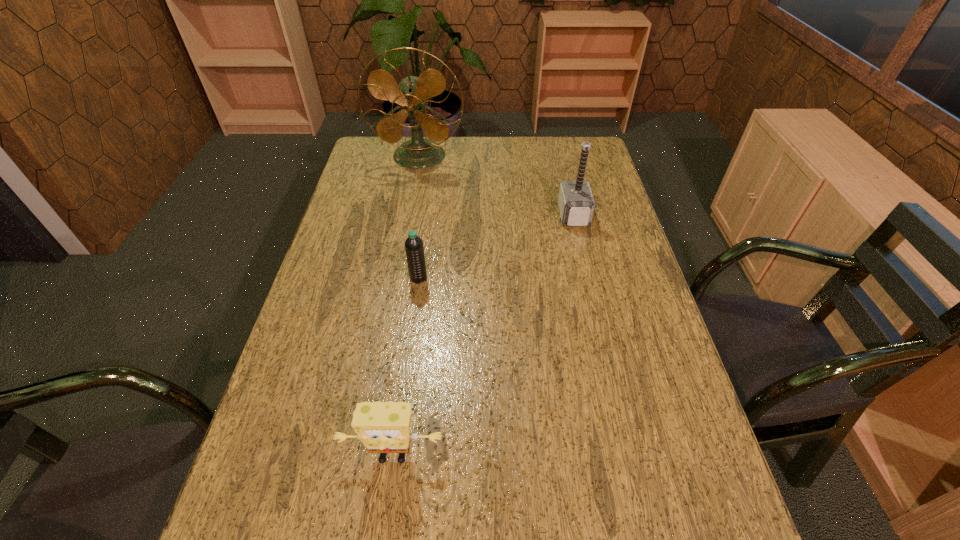
I want to click on free space at the far right corner of the desktop, so click(597, 170).

What are the coordinates of `vacant area between the rightmost object and the third farthest object` in the screenshot? It's located at (496, 247).

Locate an element on the screen. This screenshot has height=540, width=960. free space that is in between the tallest object and the sponge is located at coordinates (406, 306).

Locate an element on the screen. This screenshot has height=540, width=960. free area in between the second farthest object and the sponge is located at coordinates (483, 335).

Image resolution: width=960 pixels, height=540 pixels. Identify the location of empty space between the nearest object and the second farthest object. (483, 335).

Where is `vacant area that lies between the hammer and the third farthest object`? The image size is (960, 540). vacant area that lies between the hammer and the third farthest object is located at coordinates (496, 247).

What are the coordinates of `vacant area that lies between the second farthest object and the nearest object` in the screenshot? It's located at (483, 335).

Identify the location of free space between the sponge and the rightmost object. The height and width of the screenshot is (540, 960). (483, 335).

Image resolution: width=960 pixels, height=540 pixels. What are the coordinates of `vacant area that lies between the tallest object and the water bottle` in the screenshot? It's located at (419, 217).

I want to click on free space between the water bottle and the nearest object, so click(406, 367).